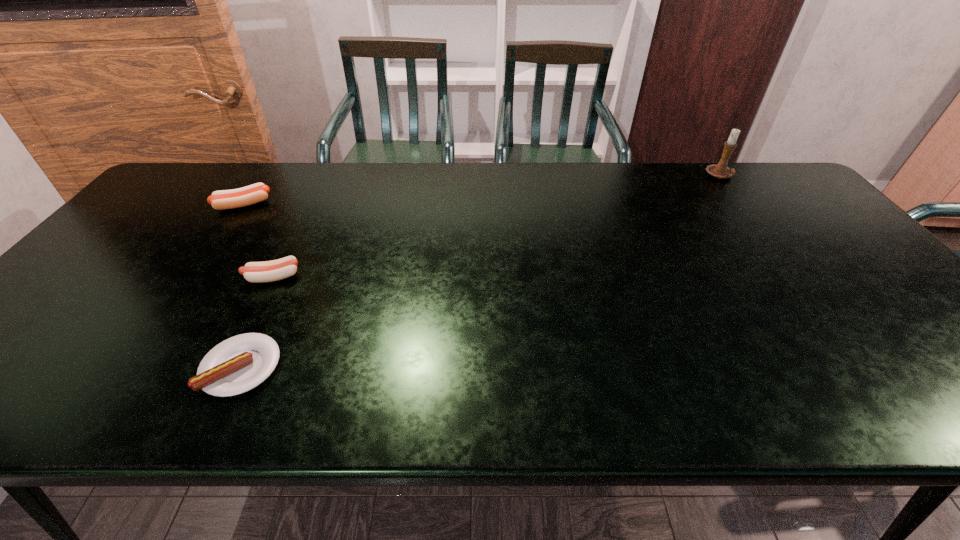
In order to click on free spot between the third farthest object and the shortest sausage in this screenshot , I will do `click(257, 322)`.

Where is `free space between the shortest object and the second nearest object`? free space between the shortest object and the second nearest object is located at coordinates (257, 322).

Where is `free space that is in between the rightmost object and the shortest sausage`? The image size is (960, 540). free space that is in between the rightmost object and the shortest sausage is located at coordinates pyautogui.click(x=481, y=272).

You are a GUI agent. You are given a task and a screenshot of the screen. Output one action in this format:
    pyautogui.click(x=<x>, y=<y>)
    Task: Click on the unoccupied position between the third nearest object and the third farthest object
    
    Given the screenshot: What is the action you would take?
    pyautogui.click(x=258, y=241)

At what (x,y) coordinates should I click in order to perform the action: click on empty location between the leftmost object and the shortest object. Please return your answer as a coordinate pair (x, y). Looking at the image, I should click on [243, 286].

Where is `vacant area that lies between the nearest object and the farthest sausage`? This screenshot has height=540, width=960. vacant area that lies between the nearest object and the farthest sausage is located at coordinates (243, 286).

Where is `vacant space that's between the second farthest sausage and the rightmost object`? Image resolution: width=960 pixels, height=540 pixels. vacant space that's between the second farthest sausage and the rightmost object is located at coordinates (496, 227).

Where is `unoccupied area between the nearest object and the rightmost object`? The height and width of the screenshot is (540, 960). unoccupied area between the nearest object and the rightmost object is located at coordinates (481, 272).

At what (x,y) coordinates should I click in order to perform the action: click on object that is the second nearest to the rightmost object. Please return your answer as a coordinate pair (x, y). The width and height of the screenshot is (960, 540). Looking at the image, I should click on (236, 365).

Select which object appears as the second closest to the second farthest sausage. Please provide its 2D coordinates. Your answer should be formatted as a tuple, i.e. [(x, y)], where the tuple contains the x and y coordinates of a point satisfying the conditions above.

[(224, 199)]